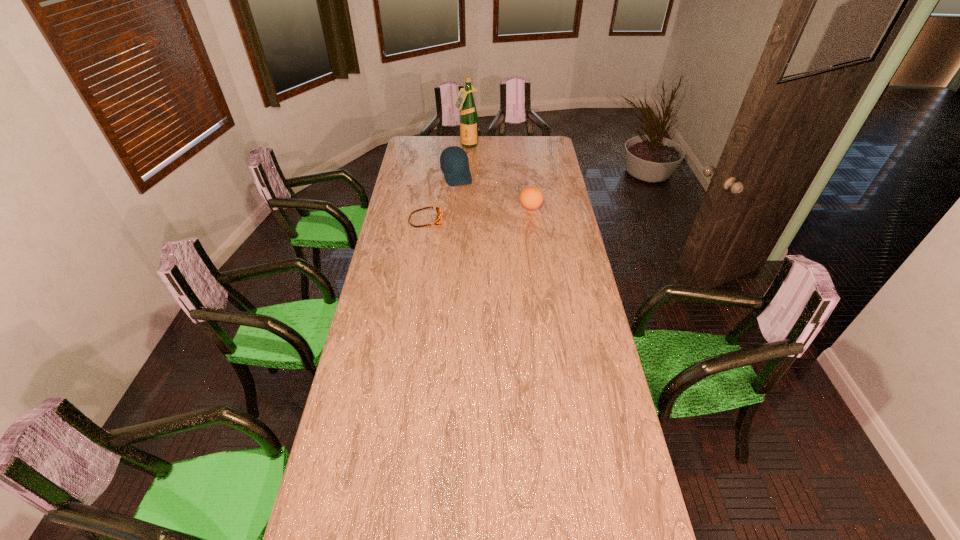
Where is `vacant space situated 0.180m on the front-facing side of the farthest object`? The image size is (960, 540). vacant space situated 0.180m on the front-facing side of the farthest object is located at coordinates (471, 166).

Where is `vacant space located on the front-facing side of the farthest object`? The image size is (960, 540). vacant space located on the front-facing side of the farthest object is located at coordinates (472, 170).

The height and width of the screenshot is (540, 960). I want to click on vacant space located on the front-facing side of the second tallest object, so click(x=470, y=211).

Where is `vacant space situated 0.110m on the front-facing side of the second tallest object`? This screenshot has width=960, height=540. vacant space situated 0.110m on the front-facing side of the second tallest object is located at coordinates (465, 198).

Identify the location of vacant space located 0.100m on the front-facing side of the second tallest object. (465, 197).

You are a GUI agent. You are given a task and a screenshot of the screen. Output one action in this format:
    pyautogui.click(x=<x>, y=<y>)
    Task: Click on the object that is at the far edge
    This screenshot has width=960, height=540.
    Given the screenshot: What is the action you would take?
    pyautogui.click(x=465, y=102)

Locate an element on the screen. The image size is (960, 540). object that is at the left edge is located at coordinates (438, 220).

The width and height of the screenshot is (960, 540). Identify the location of object located at the right edge. (531, 197).

At what (x,y) coordinates should I click in order to perform the action: click on free space at the far edge. Please return your answer as a coordinate pair (x, y). This screenshot has height=540, width=960. Looking at the image, I should click on (516, 153).

Locate an element on the screen. The width and height of the screenshot is (960, 540). vacant space at the near edge of the desktop is located at coordinates (535, 497).